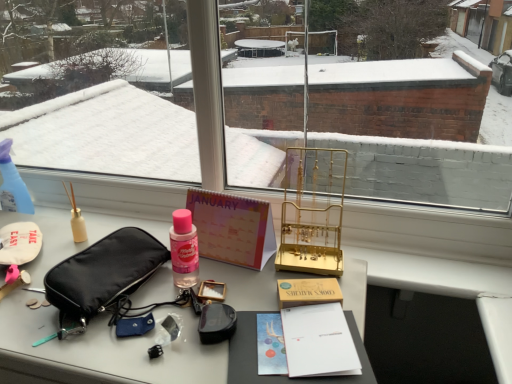
Question: Is pastel paper calendar at center completely or partially inside matte black pouch at left?

Choices:
 (A) no
 (B) yes

Answer: (A)

Question: Is matte black pouch at left in front of pastel paper calendar at center?

Choices:
 (A) no
 (B) yes

Answer: (B)

Question: Does matte black pouch at left have a lesser width compared to pastel paper calendar at center?

Choices:
 (A) no
 (B) yes

Answer: (A)

Question: From a real-world perspective, is matte black pouch at left under pastel paper calendar at center?

Choices:
 (A) yes
 (B) no

Answer: (A)

Question: Would you say matte black pouch at left is a long distance from pastel paper calendar at center?

Choices:
 (A) yes
 (B) no

Answer: (B)

Question: Looking at the image, does pastel paper calendar at center seem bigger or smaller compared to gold metallic jewelry stand at center?

Choices:
 (A) big
 (B) small

Answer: (B)

Question: From the image's perspective, relative to gold metallic jewelry stand at center, is pastel paper calendar at center above or below?

Choices:
 (A) below
 (B) above

Answer: (A)

Question: Is pastel paper calendar at center in front of or behind gold metallic jewelry stand at center in the image?

Choices:
 (A) front
 (B) behind

Answer: (B)

Question: Is point (249, 244) positioned closer to the camera than point (297, 160)?

Choices:
 (A) closer
 (B) farther

Answer: (A)

Question: From the image's perspective, is transparent plastic spray bottle at left positioned above or below gold metallic jewelry stand at center?

Choices:
 (A) above
 (B) below

Answer: (A)

Question: Would you say transparent plastic spray bottle at left is to the left or to the right of gold metallic jewelry stand at center in the picture?

Choices:
 (A) left
 (B) right

Answer: (A)

Question: In terms of width, does transparent plastic spray bottle at left look wider or thinner when compared to gold metallic jewelry stand at center?

Choices:
 (A) wide
 (B) thin

Answer: (B)

Question: Choose the correct answer: Is transparent plastic spray bottle at left inside gold metallic jewelry stand at center or outside it?

Choices:
 (A) outside
 (B) inside

Answer: (A)

Question: Which is correct: transparent plastic spray bottle at left is inside matte black pouch at left, or outside of it?

Choices:
 (A) inside
 (B) outside

Answer: (B)

Question: From the image's perspective, is transparent plastic spray bottle at left above or below matte black pouch at left?

Choices:
 (A) above
 (B) below

Answer: (A)